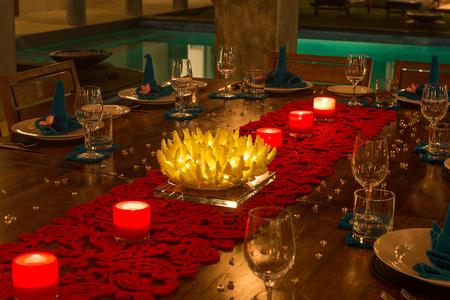
At what (x,y) coordinates should I click in order to perform the action: click on wooden table. Please return your answer as a coordinate pair (x, y). The width and height of the screenshot is (450, 300). Looking at the image, I should click on (323, 267).